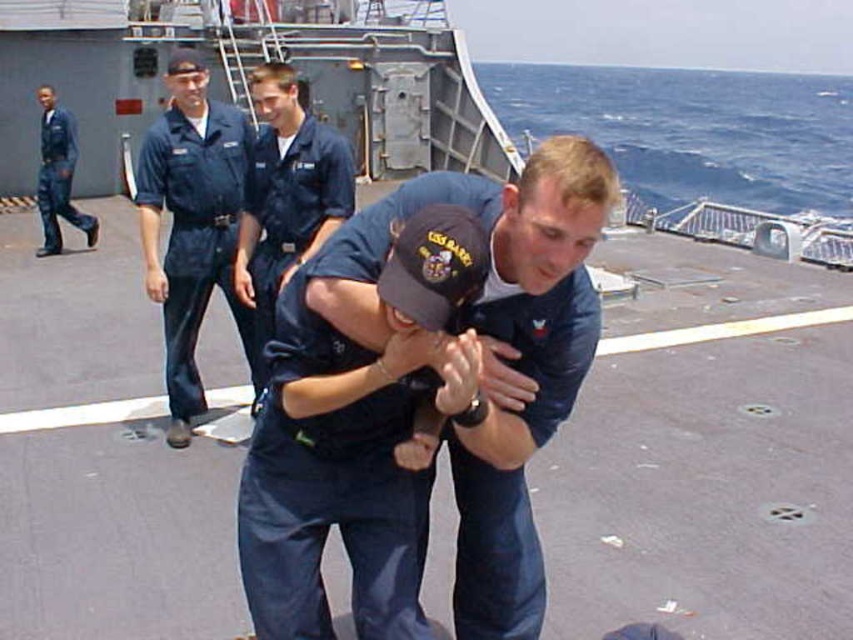
Is navy blue uniform at left thinner than blue uniform at center?

Yes, navy blue uniform at left is thinner than blue uniform at center.

Which is in front, point (163, 273) or point (259, 269)?

Positioned in front is point (259, 269).

Is point (223, 204) positioned behind point (254, 268)?

Yes, point (223, 204) is farther from viewer.

Find the location of `navy blue uniform at left`. navy blue uniform at left is located at coordinates (196, 234).

Between point (325, 513) and point (254, 385), which one is positioned in front?

Point (325, 513) is in front.

Can you confirm if navy blue uniform at center is wider than navy blue uniform at left?

Correct, the width of navy blue uniform at center exceeds that of navy blue uniform at left.

The height and width of the screenshot is (640, 853). What do you see at coordinates (410, 388) in the screenshot? I see `navy blue uniform at center` at bounding box center [410, 388].

Identify the location of navy blue uniform at center. This screenshot has width=853, height=640. (410, 388).

Can you confirm if navy blue uniform at center is thinner than blue uniform at center?

Incorrect, navy blue uniform at center's width is not less than blue uniform at center's.

Who is lower down, navy blue uniform at center or blue uniform at center?

navy blue uniform at center is lower down.

This screenshot has height=640, width=853. What do you see at coordinates (410, 388) in the screenshot?
I see `navy blue uniform at center` at bounding box center [410, 388].

Where is `navy blue uniform at center`? This screenshot has width=853, height=640. navy blue uniform at center is located at coordinates (410, 388).